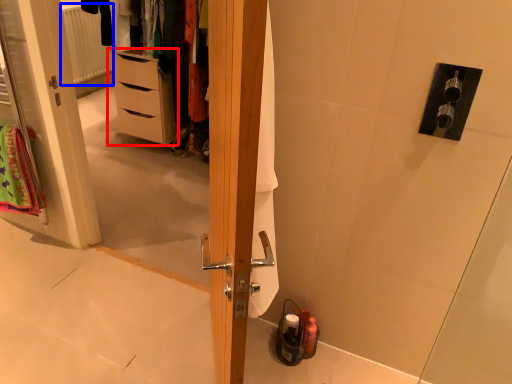
Question: Which point is closer to the camera, chest of drawers (highlighted by a red box) or radiator (highlighted by a blue box)?

Choices:
 (A) chest of drawers
 (B) radiator

Answer: (A)